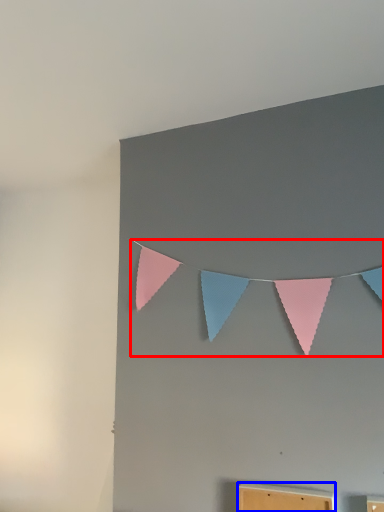
Question: Which point is further to the camera, clothesline (highlighted by a red box) or furniture (highlighted by a blue box)?

Choices:
 (A) clothesline
 (B) furniture

Answer: (A)